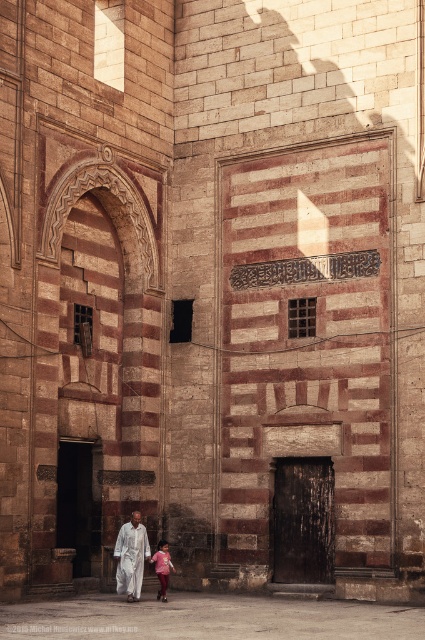
Question: Which point is farther to the camera?

Choices:
 (A) (129, 566)
 (B) (158, 561)
 (C) (127, 580)

Answer: (B)

Question: Which of the following is the closest to the observer?

Choices:
 (A) (163, 577)
 (B) (129, 528)

Answer: (A)

Question: Does white cotton robe at center appear under pink fabric dress at lower center?

Choices:
 (A) no
 (B) yes

Answer: (A)

Question: Can you confirm if white matte robe at center is positioned to the left of pink fabric dress at lower center?

Choices:
 (A) no
 (B) yes

Answer: (B)

Question: Which of these objects is positioned closest to the pink fabric dress at lower center?

Choices:
 (A) white matte robe at center
 (B) white cotton robe at center

Answer: (A)

Question: Observing the image, what is the correct spatial positioning of white cotton robe at center in reference to pink fabric dress at lower center?

Choices:
 (A) right
 (B) left

Answer: (B)